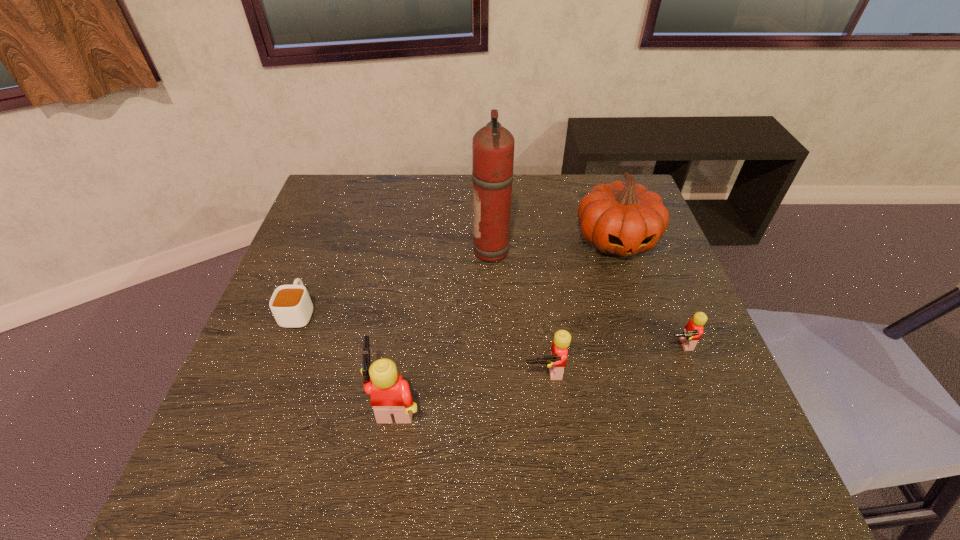
Where is `blank space located 0.180m on the side with the handle of the cup`? This screenshot has width=960, height=540. blank space located 0.180m on the side with the handle of the cup is located at coordinates coord(324,246).

The width and height of the screenshot is (960, 540). Identify the location of free space located 0.350m on the side with the handle of the cup. (338, 208).

Locate an element on the screen. The height and width of the screenshot is (540, 960). object that is at the far edge is located at coordinates (623, 218).

Find the location of `object that is at the near edge`. object that is at the near edge is located at coordinates (390, 395).

The image size is (960, 540). I want to click on object located in the left edge section of the desktop, so click(x=291, y=305).

What are the coordinates of `Lego that is at the right edge` in the screenshot? It's located at (693, 330).

What are the coordinates of `pumpkin that is at the right edge` in the screenshot? It's located at (623, 218).

The height and width of the screenshot is (540, 960). I want to click on object located at the far right corner, so click(623, 218).

The height and width of the screenshot is (540, 960). What are the coordinates of `free space at the far edge` in the screenshot? It's located at [x=422, y=175].

You are a GUI agent. You are given a task and a screenshot of the screen. Output one action in this format:
    pyautogui.click(x=<x>, y=<y>)
    Task: Click on the free point at the left edge
    The height and width of the screenshot is (540, 960).
    Given the screenshot: What is the action you would take?
    pyautogui.click(x=311, y=321)